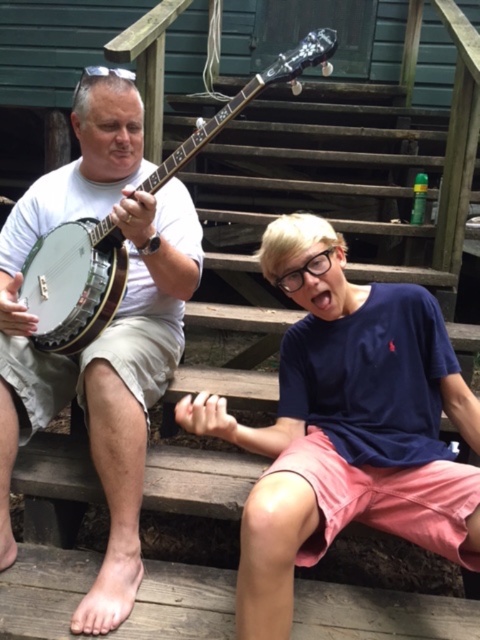
You are standing at the point marked by the coordinates point (33, 208) and want to walk towards the nearest person. Which person should you walk towards?

The distance between point (33, 208) and the viewer is 6.28 feet. Since the nearest person would be the one closest to the point, but the exact positions of the individuals aren

You are a photographer trying to capture a closeup of the banjo. The camera you have can only focus on objects within a 6 inch range. Given the distance between the matte white banjo at left and the white wooden banjo at upper center, will both banjos be in focus?

The matte white banjo at left is 7.61 inches from the white wooden banjo at upper center. Since the camera can only focus within a 6 inch range, the distance between them exceeds the camera focus range. Therefore, both banjos cannot be in focus simultaneously.